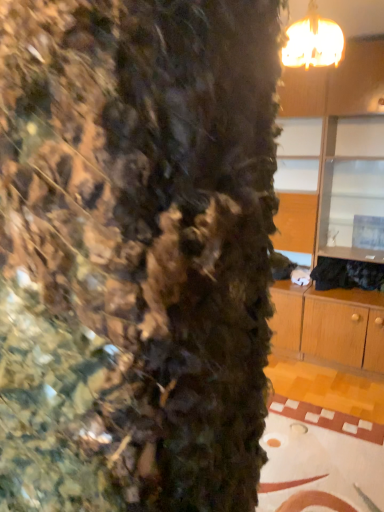
You are a GUI agent. You are given a task and a screenshot of the screen. Output one action in this format:
    pyautogui.click(x=<x>, y=<y>)
    Task: Click on the free point below matte gold chandelier at upper right (from a real-world perspective)
    The image size is (384, 512).
    Given the screenshot: What is the action you would take?
    pyautogui.click(x=290, y=456)